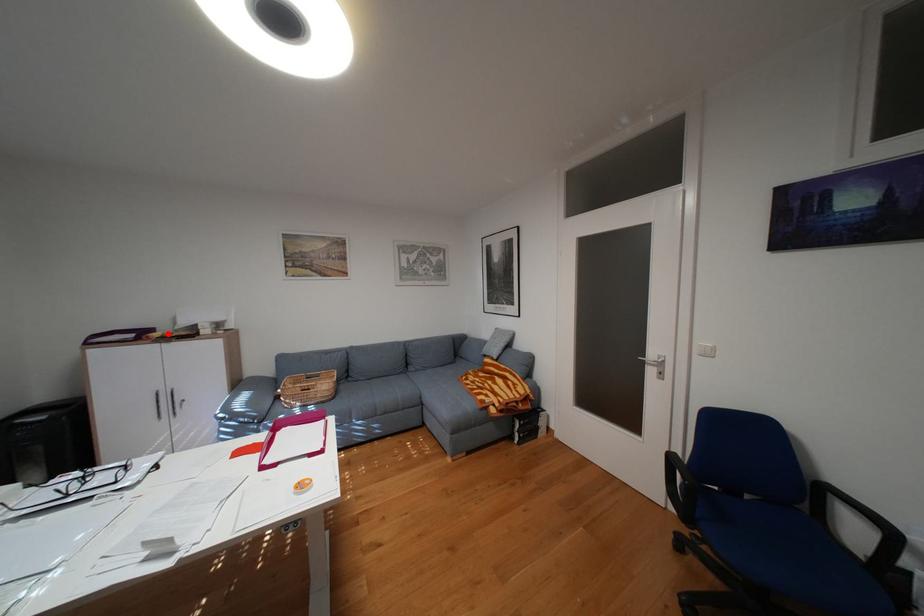
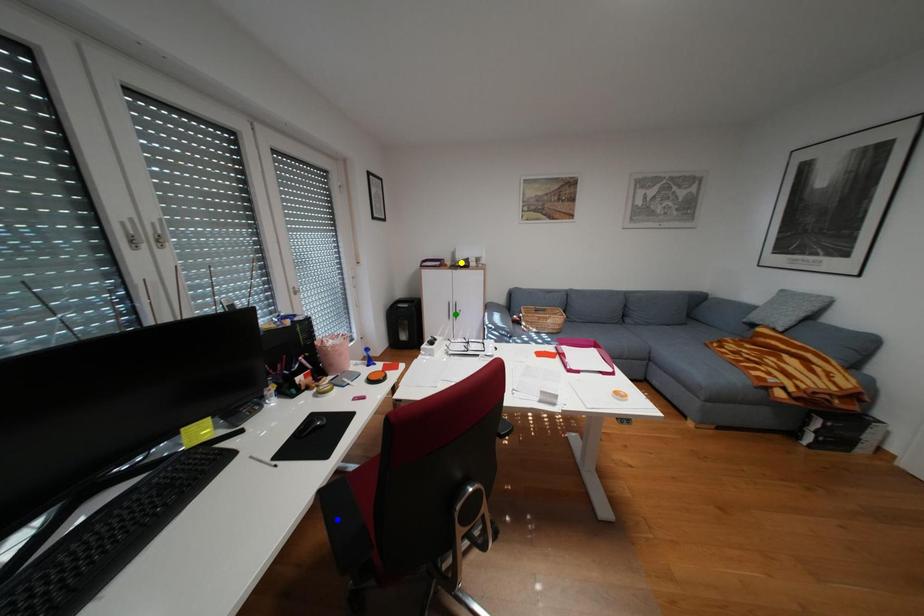
Question: I am providing you with two images of the same scene from different viewpoints. A red point is marked on the first image. You are given multiple points on the second image. Which spot in image 2 lines up with the point in image 1?

Choices:
 (A) green point
 (B) blue point
 (C) yellow point

Answer: (C)